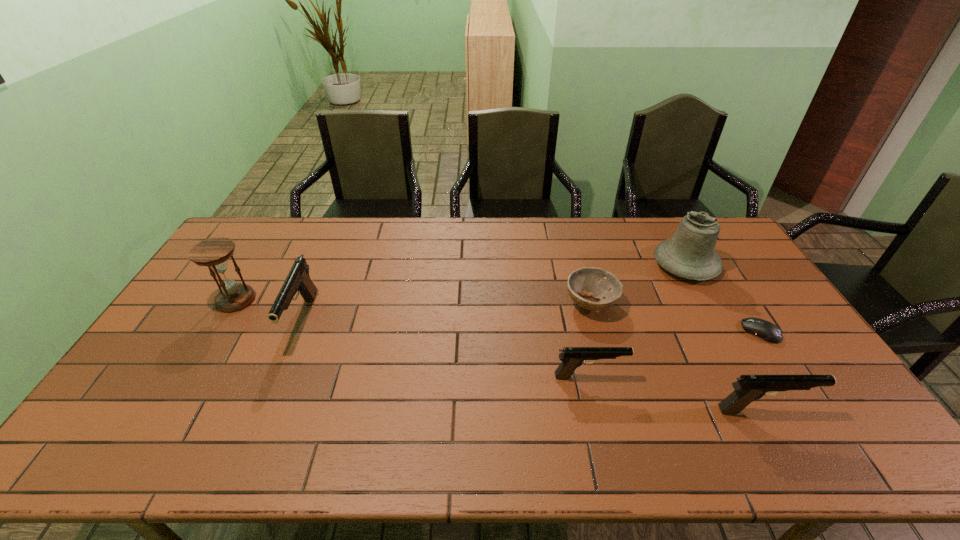
Locate an element on the screen. This screenshot has width=960, height=540. bell located in the right edge section of the desktop is located at coordinates (690, 253).

Locate an element on the screen. computer equipment situated at the right edge is located at coordinates (766, 330).

Identify the location of object situated at the far right corner. (690, 253).

Image resolution: width=960 pixels, height=540 pixels. Find the location of `object that is at the near right corner`. object that is at the near right corner is located at coordinates (748, 388).

Where is `free space at the far edge of the desktop`? Image resolution: width=960 pixels, height=540 pixels. free space at the far edge of the desktop is located at coordinates (452, 233).

You are a GUI agent. You are given a task and a screenshot of the screen. Output one action in this format:
    pyautogui.click(x=<x>, y=<y>)
    Task: Click on the vacant space at the near edge of the desktop
    This screenshot has height=540, width=960.
    Given the screenshot: What is the action you would take?
    pyautogui.click(x=441, y=416)

The image size is (960, 540). In the image, there is a desktop. Identify the location of free space at the left edge. (193, 290).

This screenshot has height=540, width=960. I want to click on free space at the right edge, so click(x=745, y=280).

Locate an element on the screen. This screenshot has height=540, width=960. free region at the near left corner of the desktop is located at coordinates pos(172,393).

Image resolution: width=960 pixels, height=540 pixels. I want to click on blank space at the near right corner of the desktop, so click(x=859, y=418).